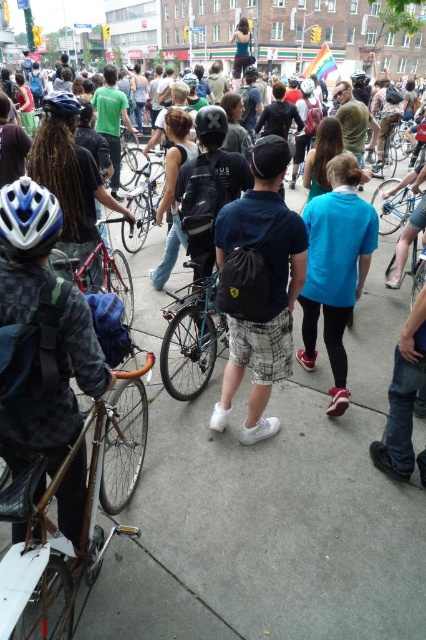
Who is taller, shiny metallic bicycle at center or blue metallic bicycle at center right?

blue metallic bicycle at center right

Is shiny metallic bicycle at center taller than blue metallic bicycle at center right?

Incorrect, shiny metallic bicycle at center's height is not larger of blue metallic bicycle at center right's.

Image resolution: width=426 pixels, height=640 pixels. In order to click on shiny metallic bicycle at center in this screenshot , I will do `click(192, 339)`.

I want to click on shiny metallic bicycle at center, so click(192, 339).

Which is above, matte black helmet at left or white matte bicycle helmet at center?

Positioned higher is white matte bicycle helmet at center.

Who is shorter, matte black helmet at left or white matte bicycle helmet at center?

white matte bicycle helmet at center is shorter.

Measure the distance between matte black helmet at left and camera.

matte black helmet at left is 7.89 meters away from camera.

The width and height of the screenshot is (426, 640). In order to click on matte black helmet at left in this screenshot , I will do `click(58, 394)`.

Is white matte bicycle helmet at left wider than shiny silver bicycle at center?

Incorrect, white matte bicycle helmet at left's width does not surpass shiny silver bicycle at center's.

In the scene shown: Between white matte bicycle helmet at left and shiny silver bicycle at center, which one has less height?

With less height is white matte bicycle helmet at left.

Which is behind, point (36, 204) or point (143, 209)?

The point (143, 209) is more distant.

Find the location of a particular element. The height and width of the screenshot is (640, 426). white matte bicycle helmet at left is located at coordinates (28, 220).